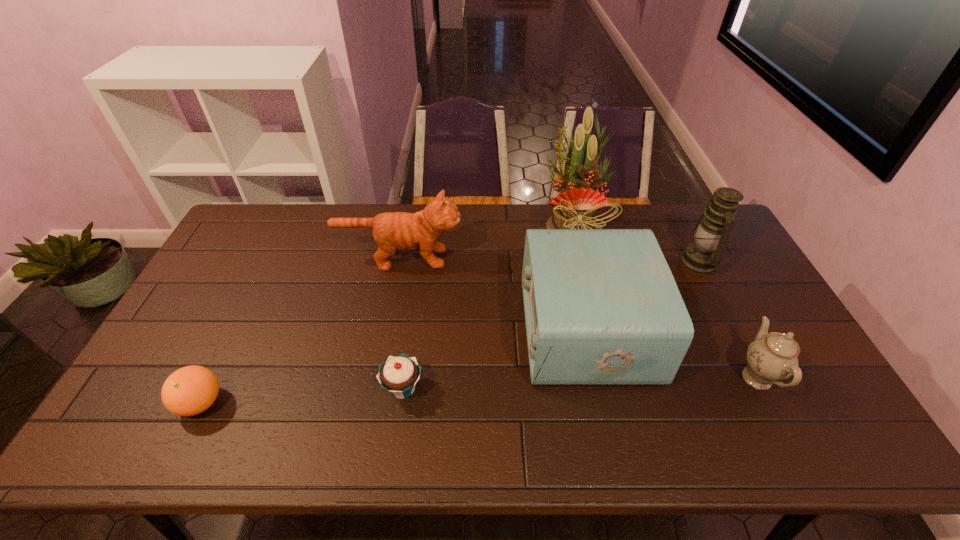
Locate an element on the screen. vacant area that satisfies the following two spatial constraints: 1. in front of the flower arrangement with the fan visible; 2. on the face of the cat is located at coordinates (581, 258).

The image size is (960, 540). I want to click on vacant space that satisfies the following two spatial constraints: 1. on the face of the cat; 2. on the back side of the oil lamp, so click(399, 262).